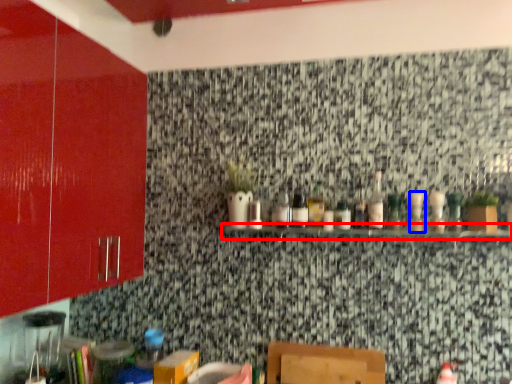
Question: Which of the following is the closest to the observer, shelf (highlighted by a red box) or bottle (highlighted by a blue box)?

Choices:
 (A) shelf
 (B) bottle

Answer: (A)